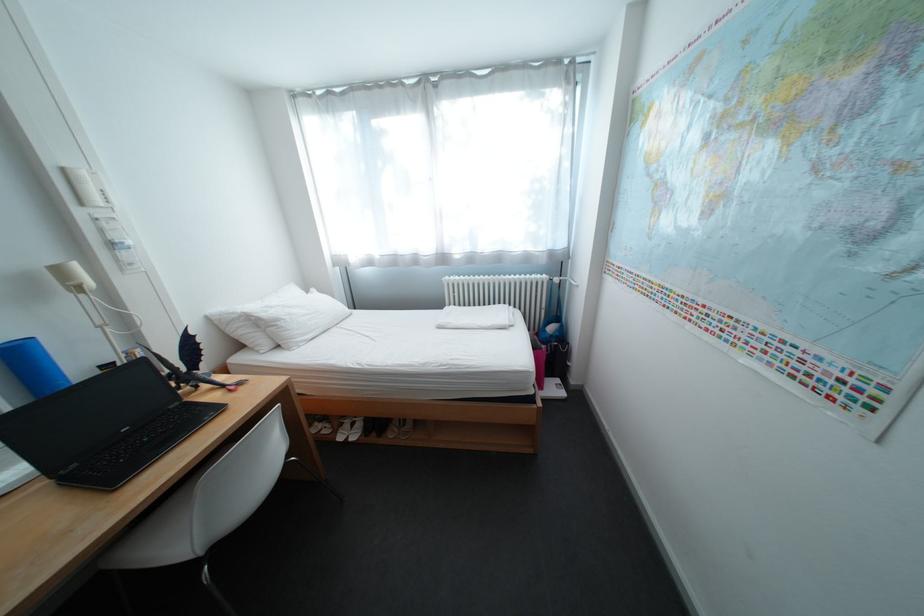
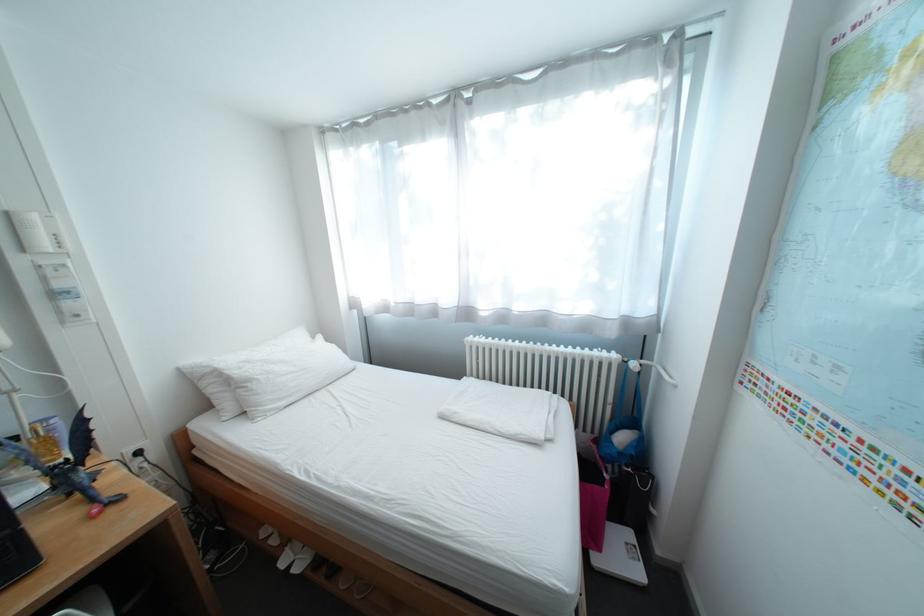
Question: How did the camera likely rotate?

Choices:
 (A) Left
 (B) Right
 (C) Up
 (D) Down

Answer: (A)